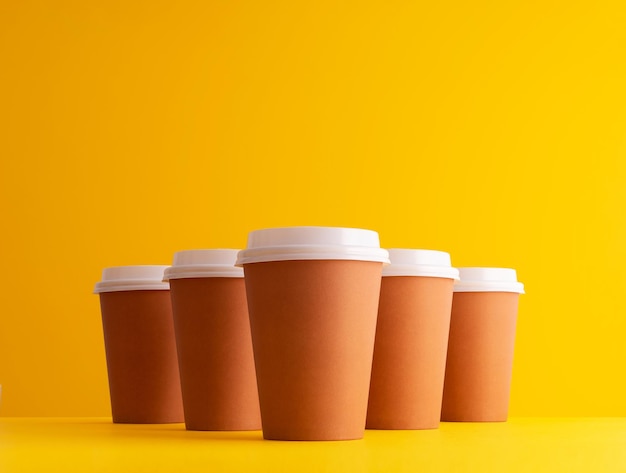
You are a GUI agent. You are given a task and a screenshot of the screen. Output one action in this format:
    pyautogui.click(x=<x>, y=<y>)
    Task: Click on the brown cups
    
    Given the screenshot: What is the action you would take?
    pyautogui.click(x=151, y=329), pyautogui.click(x=213, y=334), pyautogui.click(x=284, y=341), pyautogui.click(x=408, y=345), pyautogui.click(x=480, y=356)